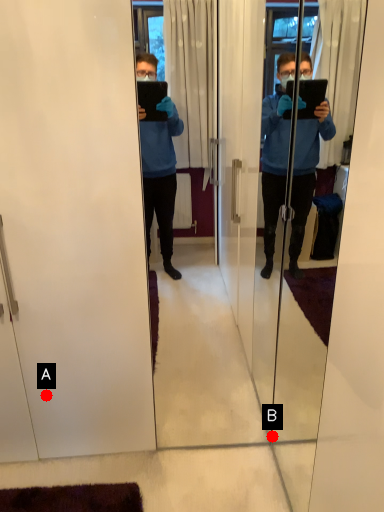
Question: Two points are circled on the image, labeled by A and B beside each circle. Among these points, which one is nearest to the camera?

Choices:
 (A) A is closer
 (B) B is closer

Answer: (A)